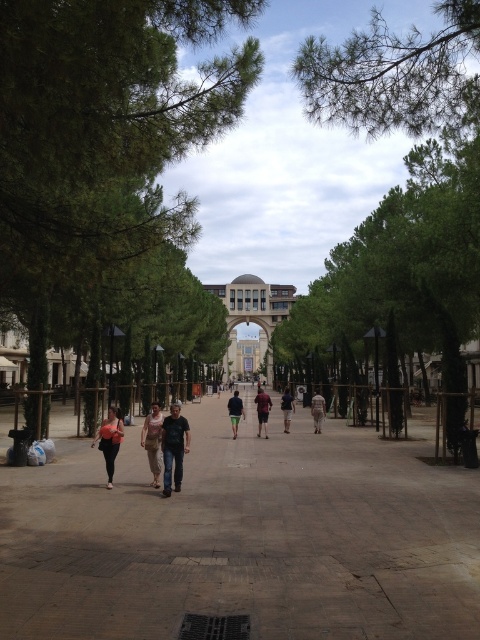
Question: Among these objects, which one is farthest from the camera?

Choices:
 (A) matte black pants at lower left
 (B) green needle-like branches at upper right
 (C) green fabric pants at center
 (D) green leafy tree at center

Answer: (C)

Question: Can you confirm if brown concrete pavement at lower left is bigger than matte black pants at lower left?

Choices:
 (A) yes
 (B) no

Answer: (A)

Question: Does green leafy tree at center appear under light beige fabric pants at center?

Choices:
 (A) no
 (B) yes

Answer: (A)

Question: Is denim jeans at center above matte black pants at lower left?

Choices:
 (A) no
 (B) yes

Answer: (A)

Question: Estimate the real-world distances between objects in this image. Which object is closer to the denim jeans at center?

Choices:
 (A) beige cotton dress at center
 (B) green needle-like branches at upper right

Answer: (A)

Question: Which point is farther to the camera?

Choices:
 (A) green leafy tree at center
 (B) dark blue shirt at center
 (C) green fabric pants at center

Answer: (B)